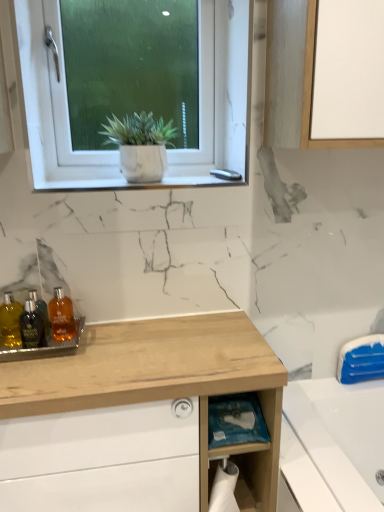
Question: Is translucent amber bottle at center, placed as the third toiletry when sorted from left to right, directly adjacent to shiny glass bottles at left, the 3th toiletry when ordered from right to left?

Choices:
 (A) yes
 (B) no

Answer: (B)

Question: Is shiny glass bottles at left, the 3th toiletry when ordered from right to left, surrounded by translucent amber bottle at center, placed as the third toiletry when sorted from left to right?

Choices:
 (A) no
 (B) yes

Answer: (A)

Question: From a real-world perspective, is translucent amber bottle at center, placed as the first toiletry when sorted from right to left, over shiny glass bottles at left, the 3th toiletry when ordered from right to left?

Choices:
 (A) yes
 (B) no

Answer: (B)

Question: Considering the relative positions of translucent amber bottle at center, placed as the first toiletry when sorted from right to left, and shiny glass bottles at left, the 3th toiletry when ordered from right to left, in the image provided, is translucent amber bottle at center, placed as the first toiletry when sorted from right to left, in front of shiny glass bottles at left, the 3th toiletry when ordered from right to left,?

Choices:
 (A) yes
 (B) no

Answer: (B)

Question: Can you confirm if translucent amber bottle at center, placed as the first toiletry when sorted from right to left, is wider than shiny glass bottles at left, the first toiletry in the left-to-right sequence?

Choices:
 (A) yes
 (B) no

Answer: (A)

Question: In the image, is translucent plastic bottles at lower left, which is counted as the 2th toiletry, starting from the right, on the left side or the right side of translucent amber bottle at center, placed as the first toiletry when sorted from right to left?

Choices:
 (A) right
 (B) left

Answer: (B)

Question: From a real-world perspective, is translucent plastic bottles at lower left, which ranks as the second toiletry in left-to-right order, positioned above or below translucent amber bottle at center, placed as the third toiletry when sorted from left to right?

Choices:
 (A) below
 (B) above

Answer: (A)

Question: Considering the positions of translucent plastic bottles at lower left, which ranks as the second toiletry in left-to-right order, and translucent amber bottle at center, placed as the first toiletry when sorted from right to left, in the image, is translucent plastic bottles at lower left, which ranks as the second toiletry in left-to-right order, bigger or smaller than translucent amber bottle at center, placed as the first toiletry when sorted from right to left,?

Choices:
 (A) small
 (B) big

Answer: (B)

Question: From their relative heights in the image, would you say translucent plastic bottles at lower left, which ranks as the second toiletry in left-to-right order, is taller or shorter than translucent amber bottle at center, placed as the third toiletry when sorted from left to right?

Choices:
 (A) short
 (B) tall

Answer: (A)

Question: Is wooden cabinet at lower left to the left or to the right of translucent amber bottle at lower left in the image?

Choices:
 (A) right
 (B) left

Answer: (A)

Question: Considering the positions of wooden cabinet at lower left and translucent amber bottle at lower left in the image, is wooden cabinet at lower left taller or shorter than translucent amber bottle at lower left?

Choices:
 (A) tall
 (B) short

Answer: (A)

Question: Is wooden cabinet at lower left wider or thinner than translucent amber bottle at lower left?

Choices:
 (A) thin
 (B) wide

Answer: (B)

Question: Does point (82, 354) appear closer or farther from the camera than point (33, 308)?

Choices:
 (A) closer
 (B) farther

Answer: (A)

Question: From their relative heights in the image, would you say blue plastic bag at lower center is taller or shorter than translucent amber bottle at center, placed as the first toiletry when sorted from right to left?

Choices:
 (A) short
 (B) tall

Answer: (A)

Question: Is point (230, 421) positioned closer to the camera than point (54, 324)?

Choices:
 (A) farther
 (B) closer

Answer: (B)